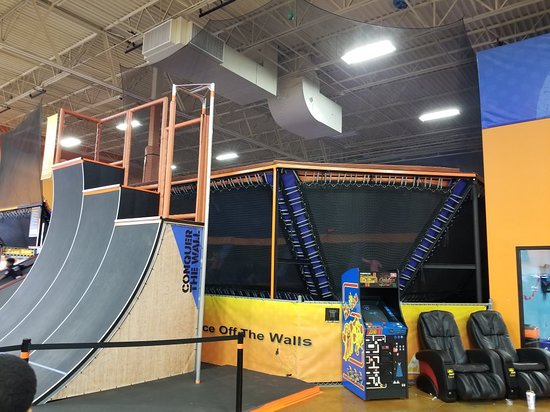
In order to click on display screen on arcade machine in this screenshot , I will do `click(370, 314)`.